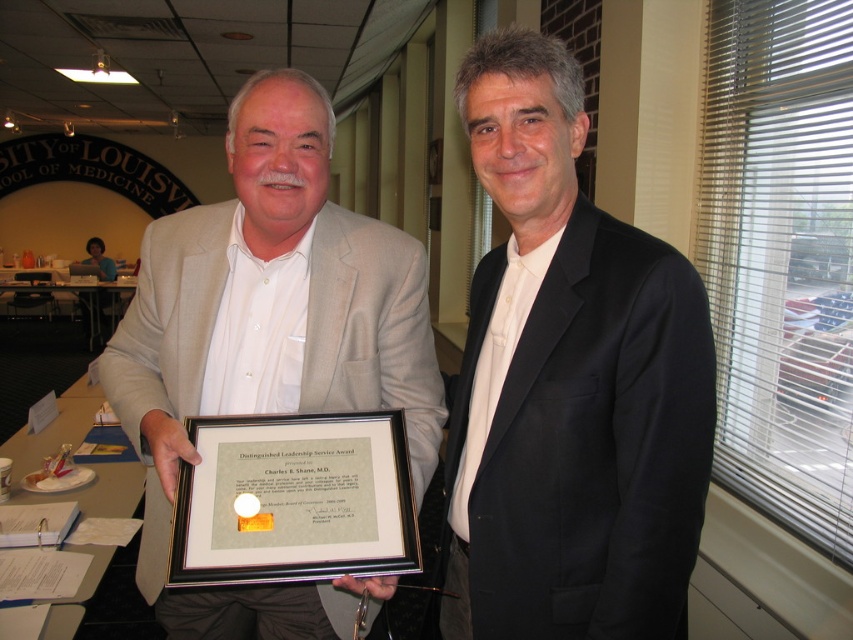
Consider the image. Is black satin suit at center below matte beige suit at center?

Actually, black satin suit at center is above matte beige suit at center.

Is point (663, 444) farther from viewer compared to point (386, 362)?

No, it is in front of (386, 362).

Find the location of a particular element. This screenshot has height=640, width=853. black satin suit at center is located at coordinates (569, 385).